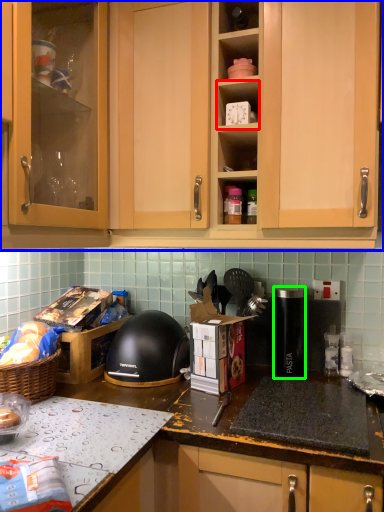
Question: Considering the real-world distances, which object is closest to shelf (highlighted by a red box)? cabinetry (highlighted by a blue box) or kitchen appliance (highlighted by a green box).

Choices:
 (A) cabinetry
 (B) kitchen appliance

Answer: (A)